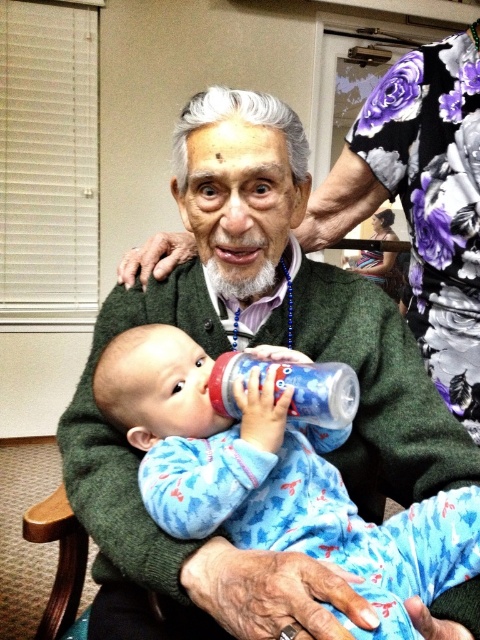
Looking at the elderly man holding the blue fleece onesie at center and the blue plastic bottle at center, which object is wider?

The blue fleece onesie at center is wider than the blue plastic bottle at center.

You are an interior designer analyzing the scene. You notice the floral fabric at upper right. Can you determine its exact location in the image using coordinates?

The floral fabric at upper right is located at coordinates point (421,202).